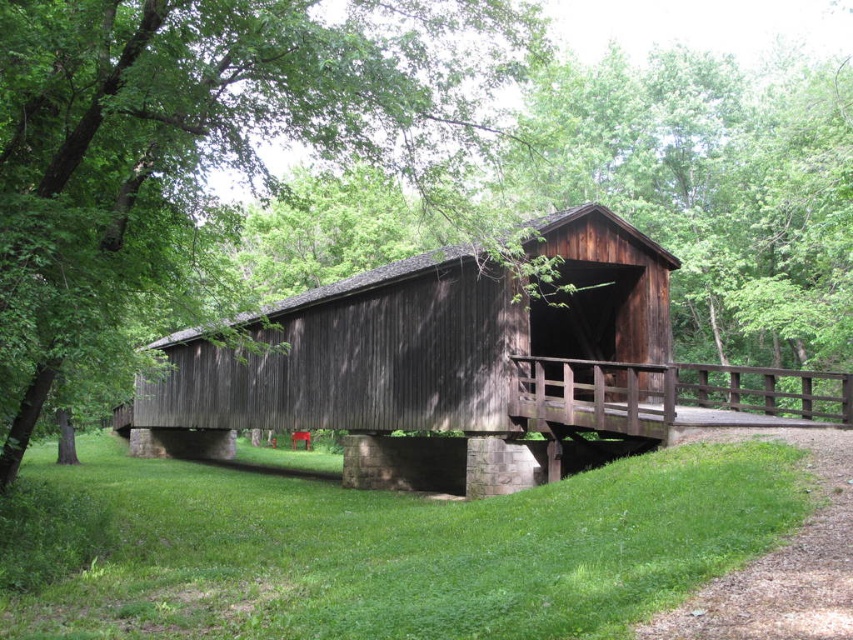
You are standing at the entrance of the rustic wooden covered bridge and want to reach the point marked at coordinates point (370, 285). Can you walk directly to that point from where you are standing?

The point (370, 285) is 21.38 meters away from the camera, so yes, you can walk directly to that point from the entrance as the distance is manageable.

You are standing on the rustic wooden covered bridge and looking towards the green wood tree at center and the green grass at lower right. Which object is higher in elevation compared to the other?

The green wood tree at center is taller than the green grass at lower right, so the green wood tree at center is higher in elevation.

You are standing at point (67, 204) and want to cross the bridge to the other side. The bridge is 10.26 meters long. If your walking speed is 1.5 meters per second, how many seconds will it take you to reach the other side?

The distance between you and the other side of the bridge is 10.26 meters. At a speed of 1.5 meters per second, it will take approximately 6.84 seconds to cross.